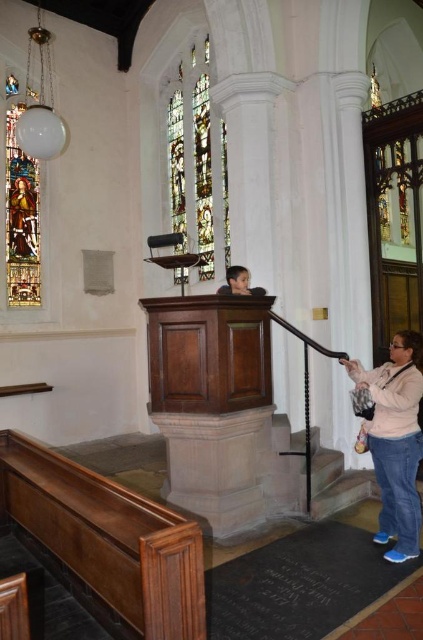
You are standing in the church and want to locate the pink fabric at lower right. According to the coordinates provided, where should you look?

You should look at point (395, 440) to find the pink fabric at lower right.

In the scene shown: You are standing in the church and want to see both the stained glass window at upper center and the pink fabric at lower right. Which object will appear closer to your eyes?

The stained glass window at upper center will appear closer to your eyes because it is further to the viewer than the pink fabric at lower right.

You are standing in the church and want to locate the stained glass window at upper center and the pink fabric at lower right. From your perspective, which object is positioned to the left of the other?

The stained glass window at upper center is to the left of pink fabric at lower right.